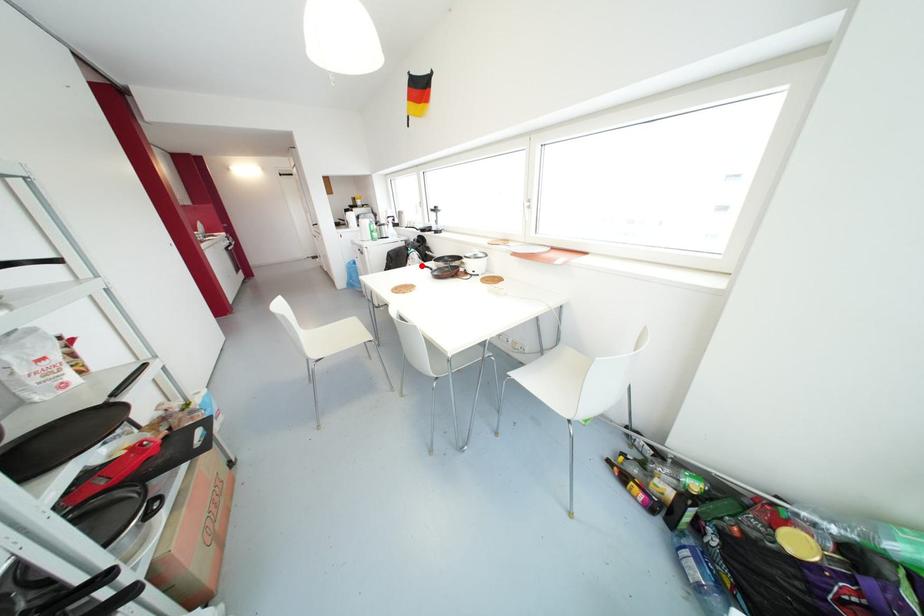
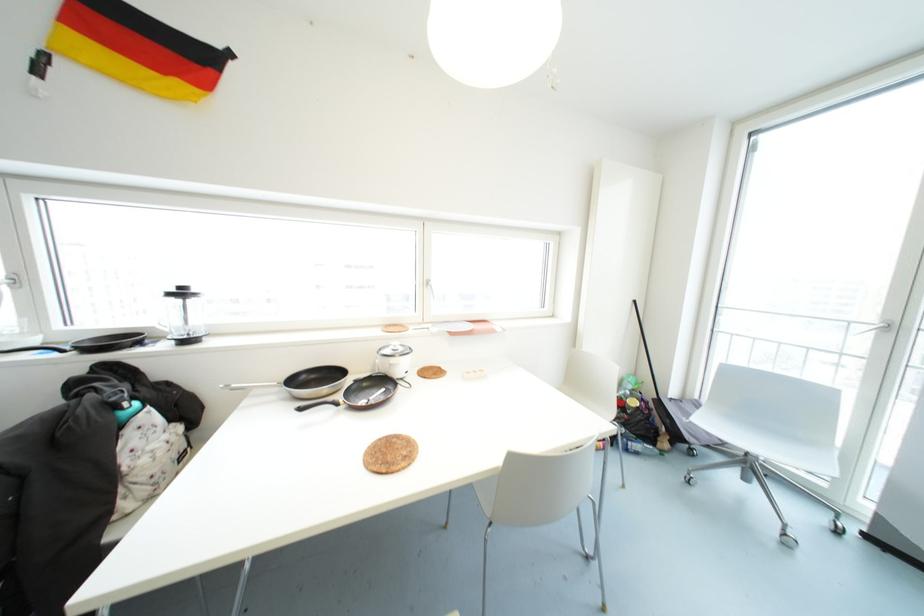
In the second image, find the point that corresponds to the highlighted location in the first image.

(300, 408)